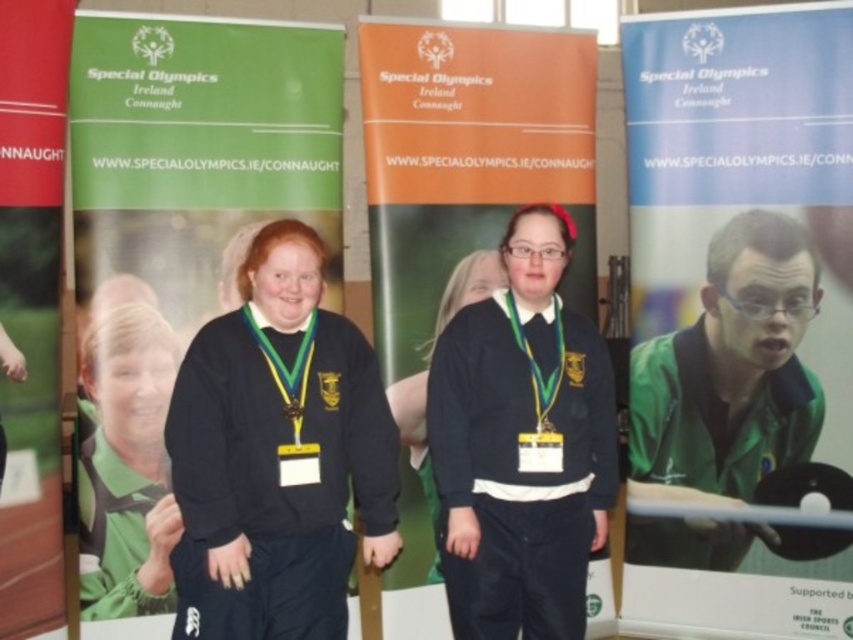
Does orange fabric banner at center appear under black matte sweater at center?

No.

Does orange fabric banner at center have a lesser width compared to black matte sweater at center?

In fact, orange fabric banner at center might be wider than black matte sweater at center.

What do you see at coordinates (466, 163) in the screenshot?
I see `orange fabric banner at center` at bounding box center [466, 163].

You are a GUI agent. You are given a task and a screenshot of the screen. Output one action in this format:
    pyautogui.click(x=<x>, y=<y>)
    Task: Click on the orange fabric banner at center
    
    Given the screenshot: What is the action you would take?
    pyautogui.click(x=466, y=163)

Which is in front, point (209, 160) or point (750, 449)?

Point (209, 160) is more forward.

Is green matte poster at center positioned at the back of green jersey at center?

That is False.

Is point (88, 20) positioned before point (699, 336)?

Yes, it is in front of point (699, 336).

Locate an element on the screen. This screenshot has height=640, width=853. green matte poster at center is located at coordinates (175, 248).

Measure the distance between point (167, 556) and camera.

They are 10.67 feet apart.

I want to click on green fabric shirt at center, so click(126, 465).

Which is in front, point (125, 378) or point (300, 401)?

Point (300, 401) is in front.

This screenshot has width=853, height=640. Find the location of `green fabric shirt at center`. green fabric shirt at center is located at coordinates (126, 465).